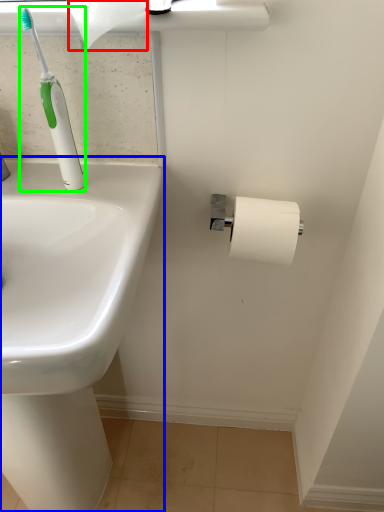
Question: Estimate the real-world distances between objects in this image. Which object is closer to toilet paper (highlighted by a red box), sink (highlighted by a blue box) or toilet brush (highlighted by a green box)?

Choices:
 (A) sink
 (B) toilet brush

Answer: (B)